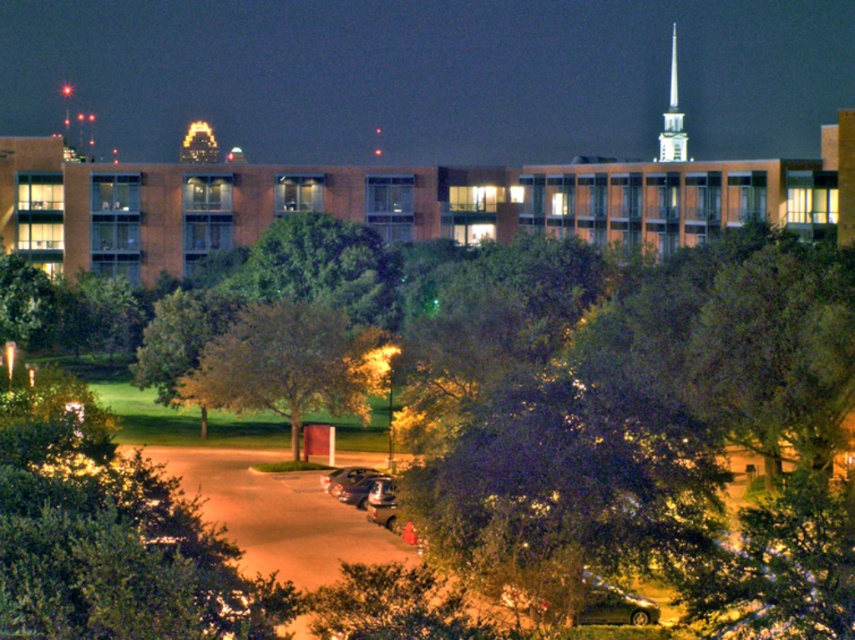
What is the spatial relationship between the green leafy tree at center and the silver metallic spire at upper right in the nighttime scene?

The green leafy tree at center is positioned to the left of the silver metallic spire at upper right.

You are standing at the point marked by the coordinates point [289,364] in the parking lot. Looking towards the building, which object is directly in front of you?

The green leafy tree at center is represented by point [289,364], so you are standing at the base of the green leafy tree at center. Therefore, the building is directly in front of you as you face towards it from the parking lot.